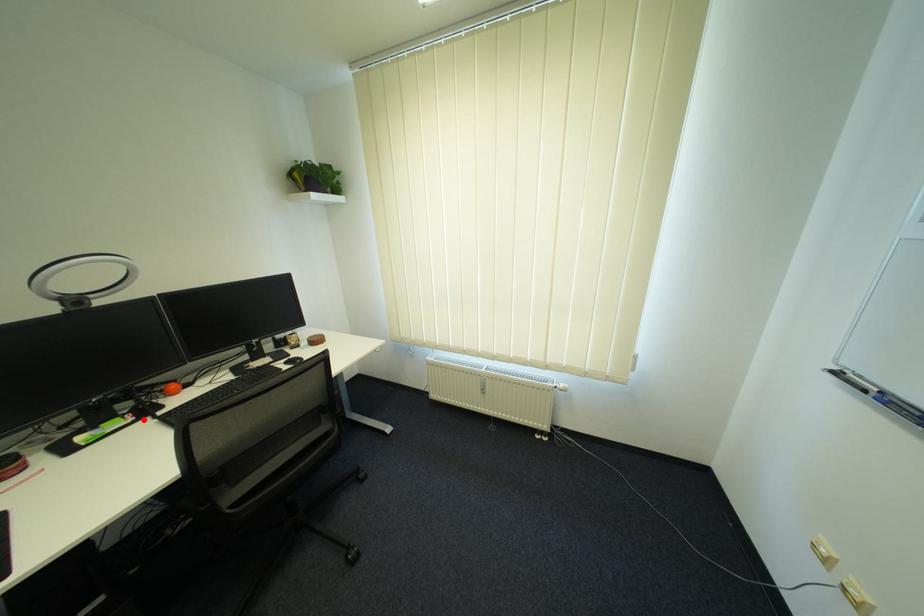
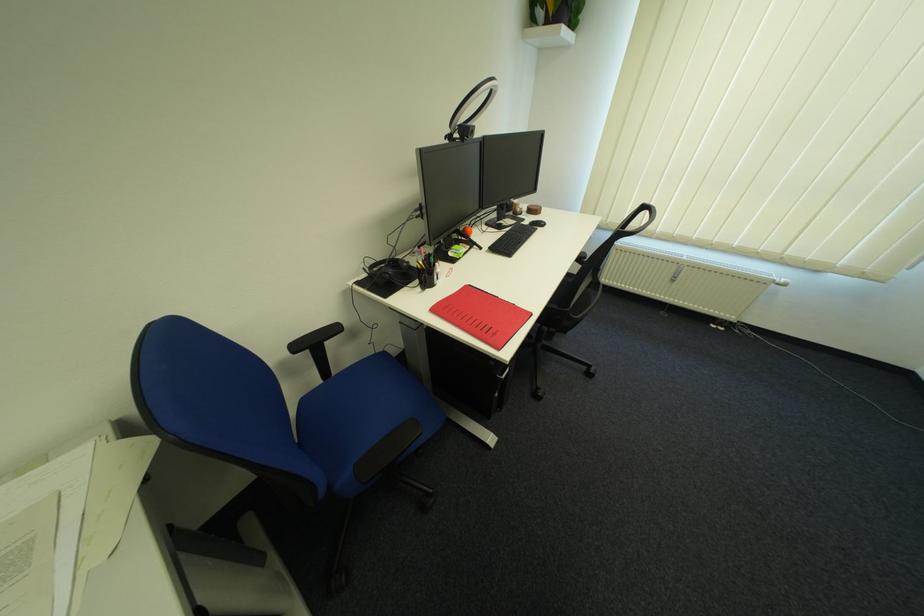
Question: I am providing you with two images of the same scene from different viewpoints. A red point is marked on the first image. Is the red point's position out of view in image 2?

Choices:
 (A) Yes
 (B) No

Answer: (B)